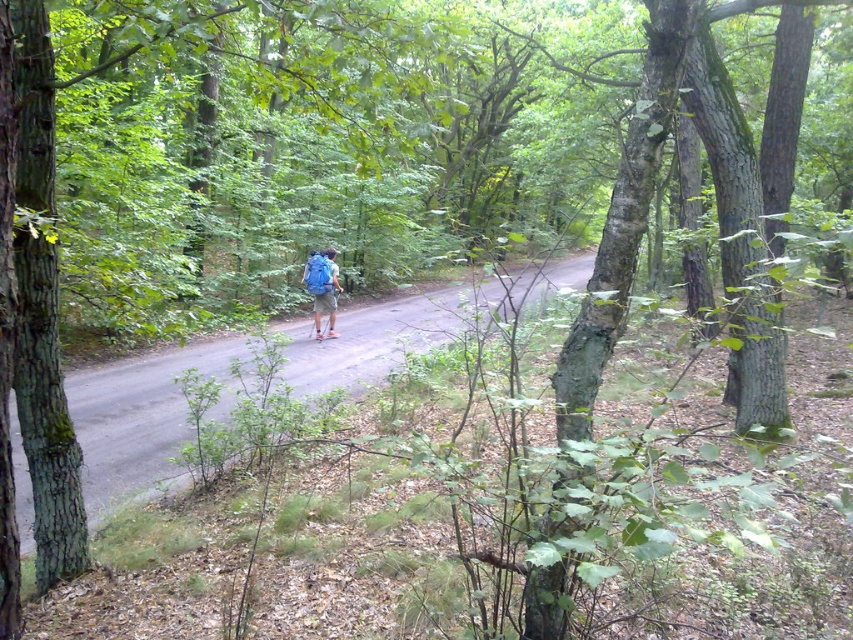
Question: Which object appears farthest from the camera in this image?

Choices:
 (A) blue fabric backpack at center
 (B) smooth asphalt road at center

Answer: (A)

Question: Does smooth asphalt road at center have a lesser width compared to blue fabric backpack at center?

Choices:
 (A) no
 (B) yes

Answer: (A)

Question: Does smooth asphalt road at center appear on the right side of blue fabric backpack at center?

Choices:
 (A) yes
 (B) no

Answer: (A)

Question: Is smooth asphalt road at center to the right of blue fabric backpack at center from the viewer's perspective?

Choices:
 (A) no
 (B) yes

Answer: (B)